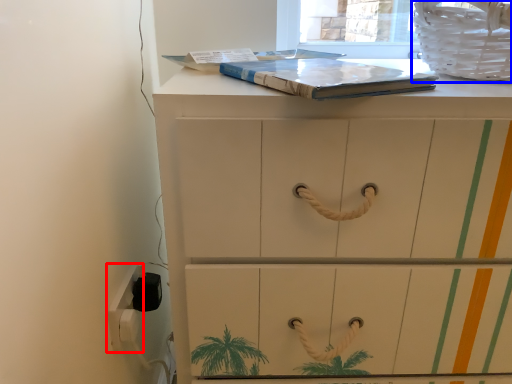
Question: Which object is further to the camera taking this photo, electric outlet (highlighted by a red box) or laundry basket (highlighted by a blue box)?

Choices:
 (A) electric outlet
 (B) laundry basket

Answer: (A)